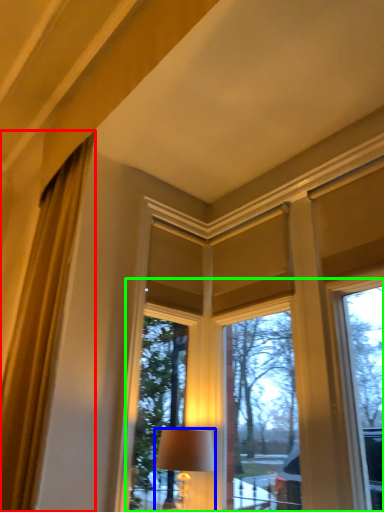
Question: Which object is the farthest from curtain (highlighted by a red box)? Choose among these: lamp (highlighted by a blue box) or bay window (highlighted by a green box).

Choices:
 (A) lamp
 (B) bay window

Answer: (B)